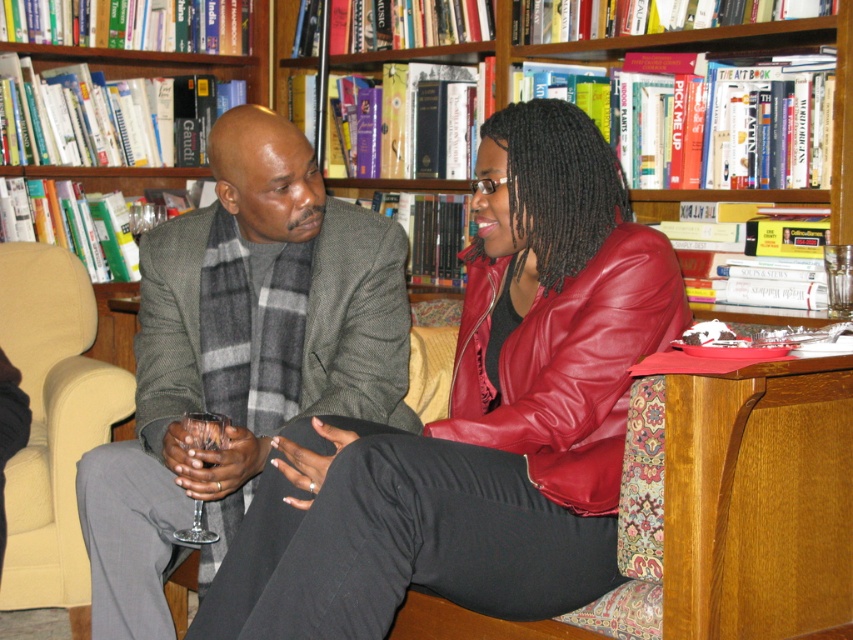
Is gray wool scarf at left to the left of wooden bookcase at upper center from the viewer's perspective?

Indeed, gray wool scarf at left is positioned on the left side of wooden bookcase at upper center.

Is gray wool scarf at left further to camera compared to wooden bookcase at upper center?

No, it is not.

Between point (316, 208) and point (817, 35), which one is positioned behind?

Point (817, 35)

The width and height of the screenshot is (853, 640). What are the coordinates of `gray wool scarf at left` in the screenshot? It's located at (239, 355).

Can you confirm if leather jacket at center is bigger than transparent glass at lower left?

Indeed, leather jacket at center has a larger size compared to transparent glass at lower left.

Can you confirm if leather jacket at center is thinner than transparent glass at lower left?

In fact, leather jacket at center might be wider than transparent glass at lower left.

Is point (518, 580) behind point (204, 532)?

No, (518, 580) is in front of (204, 532).

Find the location of `leather jacket at center`. leather jacket at center is located at coordinates (477, 420).

Which is in front, point (844, 116) or point (190, 429)?

Point (190, 429) is in front.

In the scene shown: Can you confirm if wooden bookcase at upper center is wider than transparent glass at lower left?

Yes.

Measure the distance between wooden bookcase at upper center and camera.

The distance of wooden bookcase at upper center from camera is 6.69 feet.

You are a GUI agent. You are given a task and a screenshot of the screen. Output one action in this format:
    pyautogui.click(x=<x>, y=<y>)
    Task: Click on the wooden bookcase at upper center
    This screenshot has width=853, height=640.
    Given the screenshot: What is the action you would take?
    pyautogui.click(x=743, y=51)